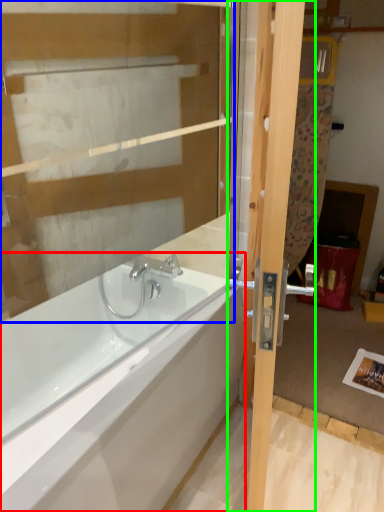
Question: Considering the real-world distances, which object is farthest from bathtub (highlighted by a red box)? glass door (highlighted by a blue box) or door (highlighted by a green box)?

Choices:
 (A) glass door
 (B) door

Answer: (A)